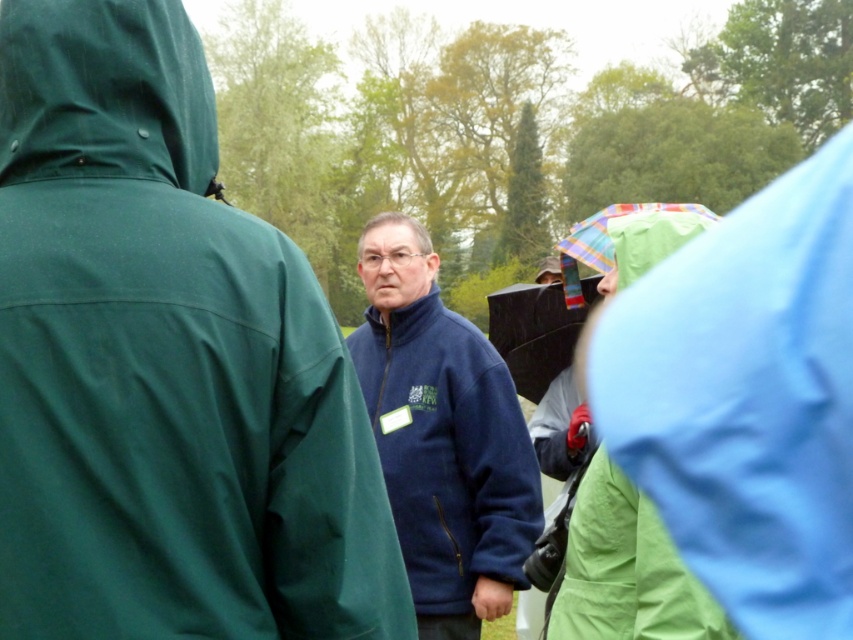
You are trying to locate the navy blue fleece at center in the park scene. Based on the coordinates provided, where exactly is the navy blue fleece positioned?

The navy blue fleece at center is located at point 0.570 in the x coordinate and 0.195 in the y coordinate.

You are standing in the park and want to walk towards the two points marked in the image. Which point, point (399, 252) or point (88, 22), will you reach first?

Point (399, 252) is further to the viewer than point (88, 22), so you will reach point (399, 252) first.